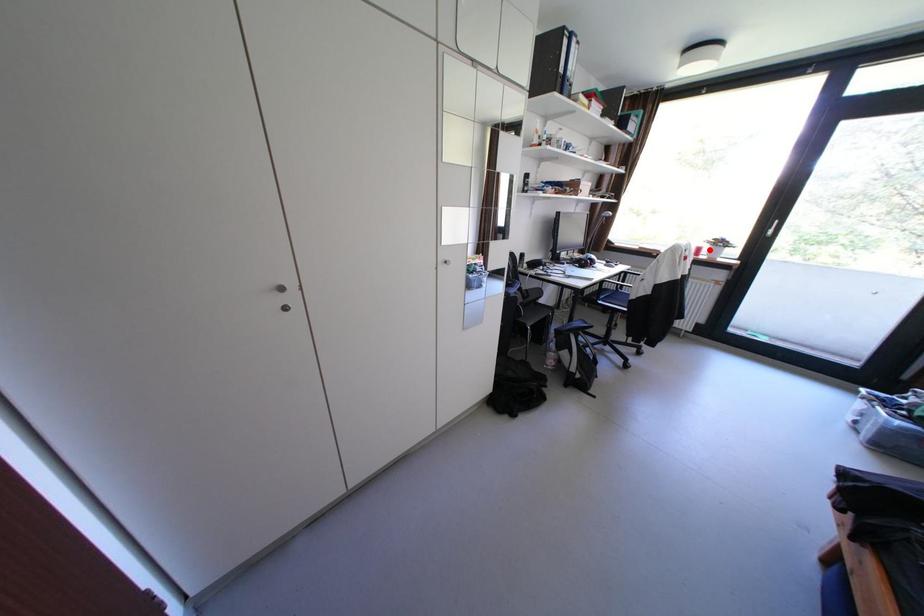
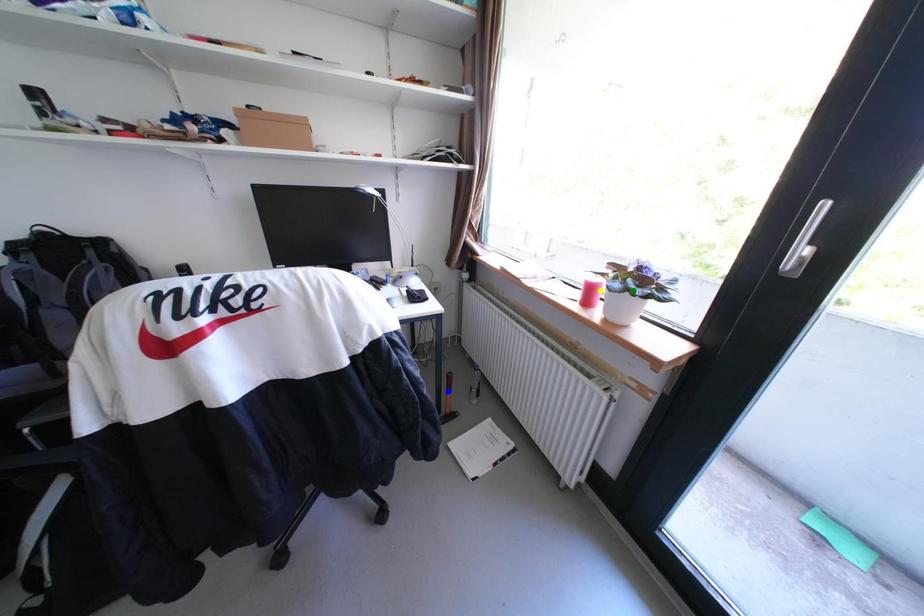
Question: I am providing you with two images of the same scene from different viewpoints. A red point is marked on the first image. You are given multiple points on the second image. Which point in image 2 is actually the same real-world point as the red point in image 1?

Choices:
 (A) yellow point
 (B) green point
 (C) blue point

Answer: (A)